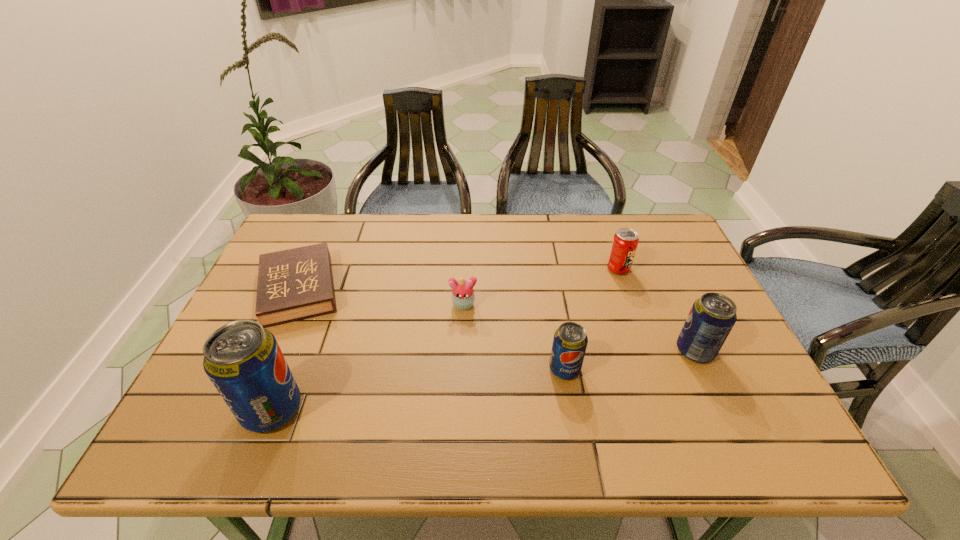
Find the location of `free region located 0.290m on the right of the nearest object`. free region located 0.290m on the right of the nearest object is located at coordinates (436, 409).

Where is `vacant region located 0.310m on the left of the second soda can from left to right`? vacant region located 0.310m on the left of the second soda can from left to right is located at coordinates (417, 369).

At what (x,y) coordinates should I click in order to perform the action: click on vacant space located on the left of the second tallest object. Please return your answer as a coordinate pair (x, y). Looking at the image, I should click on (639, 351).

Locate an element on the screen. vacant position located on the back of the hardback book is located at coordinates (320, 242).

This screenshot has height=540, width=960. I want to click on free space located 0.230m on the back of the third soda can from left to right, so click(600, 218).

The width and height of the screenshot is (960, 540). I want to click on vacant region located 0.180m on the face of the third object from left to right, so click(461, 369).

At what (x,y) coordinates should I click in order to perform the action: click on object that is at the far edge. Please return your answer as a coordinate pair (x, y). The width and height of the screenshot is (960, 540). Looking at the image, I should click on (297, 283).

The height and width of the screenshot is (540, 960). Identify the location of soda that is at the left edge. (243, 360).

Identify the location of hardback book located in the left edge section of the desktop. (297, 283).

Image resolution: width=960 pixels, height=540 pixels. In order to click on object situated at the right edge in this screenshot , I will do `click(712, 317)`.